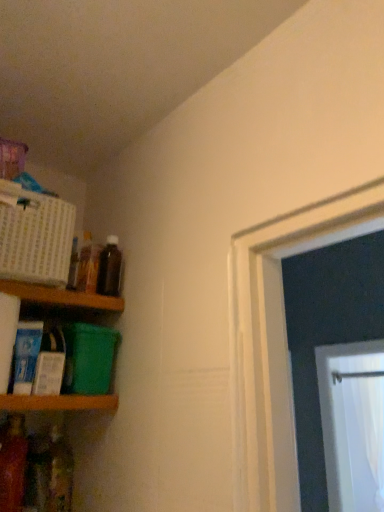
Question: Is wooden shelf at lower left, placed as the 1th shelf when sorted from bottom to top, wider than translucent plastic bottle at lower left, which appears as the 1th bottle when ordered from the bottom?

Choices:
 (A) yes
 (B) no

Answer: (A)

Question: Can you confirm if wooden shelf at lower left, arranged as the second shelf when viewed from the top, is thinner than translucent plastic bottle at lower left, the 2th bottle from the left?

Choices:
 (A) yes
 (B) no

Answer: (B)

Question: From a real-world perspective, is wooden shelf at lower left, placed as the 1th shelf when sorted from bottom to top, below translucent plastic bottle at lower left, the 2th bottle from the left?

Choices:
 (A) yes
 (B) no

Answer: (B)

Question: Is wooden shelf at lower left, placed as the 1th shelf when sorted from bottom to top, facing towards translucent plastic bottle at lower left, which appears as the 1th bottle when ordered from the bottom?

Choices:
 (A) yes
 (B) no

Answer: (B)

Question: Is wooden shelf at lower left, placed as the 1th shelf when sorted from bottom to top, to the left of translucent plastic bottle at lower left, which appears as the 1th bottle when ordered from the bottom, from the viewer's perspective?

Choices:
 (A) yes
 (B) no

Answer: (A)

Question: Is translucent plastic bottle at lower left, which is the third bottle in right-to-left order, at the back of wooden shelf at lower left, placed as the 1th shelf when sorted from bottom to top?

Choices:
 (A) yes
 (B) no

Answer: (B)

Question: Can you confirm if translucent glass bottle at upper left, marked as the third bottle in a bottom-to-top arrangement, is shorter than wooden shelf at lower left, arranged as the second shelf when viewed from the top?

Choices:
 (A) yes
 (B) no

Answer: (B)

Question: From the image's perspective, is translucent glass bottle at upper left, placed as the second bottle when sorted from right to left, over wooden shelf at lower left, placed as the 1th shelf when sorted from bottom to top?

Choices:
 (A) no
 (B) yes

Answer: (B)

Question: Is translucent glass bottle at upper left, placed as the second bottle when sorted from right to left, oriented away from wooden shelf at lower left, arranged as the second shelf when viewed from the top?

Choices:
 (A) yes
 (B) no

Answer: (B)

Question: Is the position of translucent glass bottle at upper left, marked as the third bottle in a left-to-right arrangement, more distant than that of wooden shelf at lower left, arranged as the second shelf when viewed from the top?

Choices:
 (A) no
 (B) yes

Answer: (B)

Question: Can you confirm if translucent glass bottle at upper left, placed as the second bottle when sorted from right to left, is thinner than wooden shelf at lower left, placed as the 1th shelf when sorted from bottom to top?

Choices:
 (A) no
 (B) yes

Answer: (B)

Question: From a real-world perspective, is translucent glass bottle at upper left, acting as the 2th bottle starting from the top, under wooden shelf at lower left, placed as the 1th shelf when sorted from bottom to top?

Choices:
 (A) no
 (B) yes

Answer: (A)

Question: From a real-world perspective, is translucent plastic bottle at lower left, the 2th bottle from the left, located higher than brown glass bottle at upper left, the 1th bottle when ordered from right to left?

Choices:
 (A) yes
 (B) no

Answer: (B)